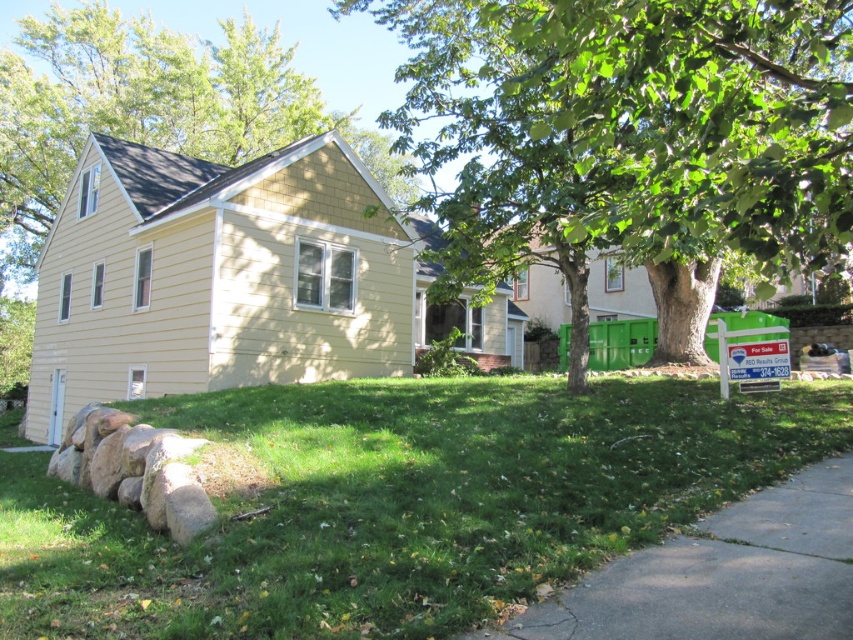
Who is higher up, green leafy tree at center or gray concrete pavement at lower right?

green leafy tree at center

Does green leafy tree at center have a greater height compared to gray concrete pavement at lower right?

Correct, green leafy tree at center is much taller as gray concrete pavement at lower right.

At what (x,y) coordinates should I click in order to perform the action: click on green leafy tree at center. Please return your answer as a coordinate pair (x, y). This screenshot has height=640, width=853. Looking at the image, I should click on (631, 140).

This screenshot has width=853, height=640. I want to click on green leafy tree at center, so coord(631,140).

Between green grass at lower center and green leafy tree at center, which one is positioned lower?

green grass at lower center is lower down.

Does green grass at lower center have a larger size compared to green leafy tree at center?

No, green grass at lower center is not bigger than green leafy tree at center.

At what (x,y) coordinates should I click in order to perform the action: click on green grass at lower center. Please return your answer as a coordinate pair (x, y). Looking at the image, I should click on (397, 502).

Find the location of a particular element. This screenshot has width=853, height=640. green grass at lower center is located at coordinates (397, 502).

Is green grass at lower center positioned at the back of gray concrete pavement at lower right?

That is True.

Image resolution: width=853 pixels, height=640 pixels. I want to click on green grass at lower center, so click(x=397, y=502).

Where is `green grass at lower center`? green grass at lower center is located at coordinates click(397, 502).